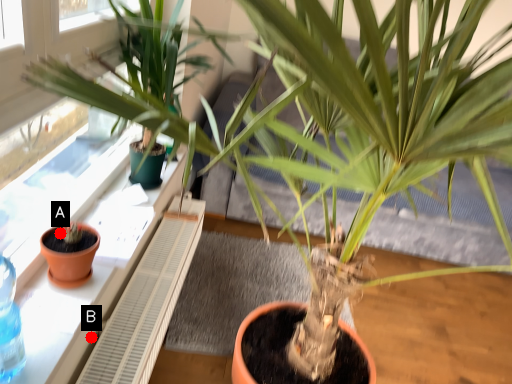
Question: Two points are circled on the image, labeled by A and B beside each circle. Among these points, which one is nearest to the camera?

Choices:
 (A) A is closer
 (B) B is closer

Answer: (A)